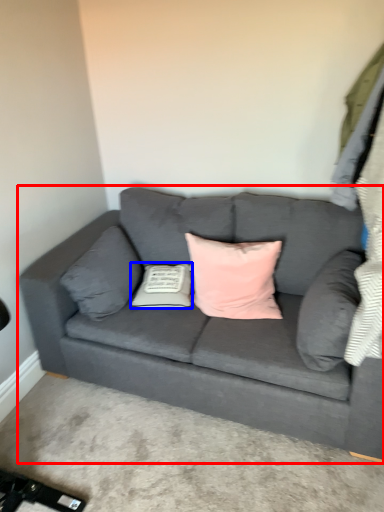
Question: Which of the following is the farthest to the observer, studio couch (highlighted by a red box) or pillow (highlighted by a blue box)?

Choices:
 (A) studio couch
 (B) pillow

Answer: (B)